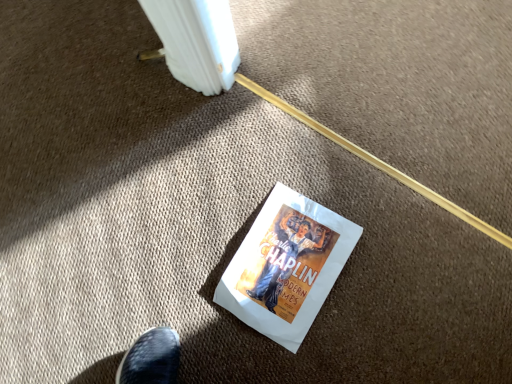
The height and width of the screenshot is (384, 512). In order to click on free space above white paper at center (from a real-world perspective) in this screenshot , I will do `click(290, 260)`.